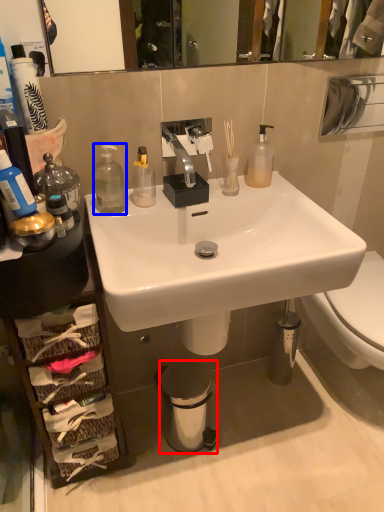
Question: Which object is further to the camera taking this photo, trash bin/can (highlighted by a red box) or bottle (highlighted by a blue box)?

Choices:
 (A) trash bin/can
 (B) bottle

Answer: (A)